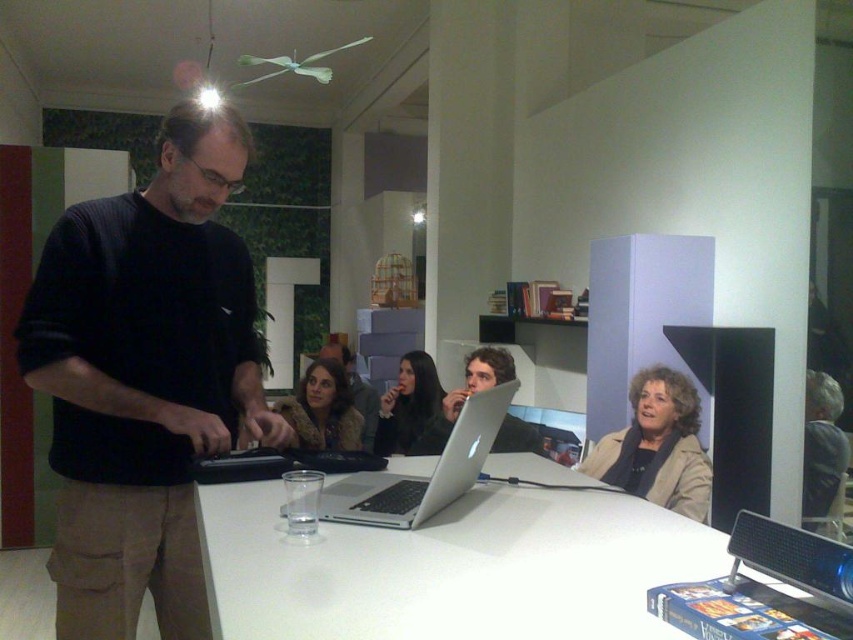
Question: Does silver metallic laptop at center lie behind matte black jacket at center?

Choices:
 (A) no
 (B) yes

Answer: (A)

Question: Which object is the closest to the smooth black jacket at center?

Choices:
 (A) beige fabric jacket at lower right
 (B) metallic silver laptop at lower right
 (C) matte black jacket at center
 (D) black matte shirt at center

Answer: (A)

Question: Which of the following is the farthest from the observer?

Choices:
 (A) gray fabric jacket at lower right
 (B) smooth black jacket at center
 (C) brown textured jacket at center
 (D) matte black jacket at center

Answer: (D)

Question: Does black matte shirt at center appear over gray fabric jacket at lower right?

Choices:
 (A) no
 (B) yes

Answer: (B)

Question: Which object is positioned closest to the beige fabric jacket at lower right?

Choices:
 (A) matte black jacket at center
 (B) smooth black jacket at center
 (C) metallic silver laptop at lower right
 (D) gray fabric jacket at lower right

Answer: (D)

Question: Can you confirm if black matte shirt at center is bigger than brown textured jacket at center?

Choices:
 (A) yes
 (B) no

Answer: (A)